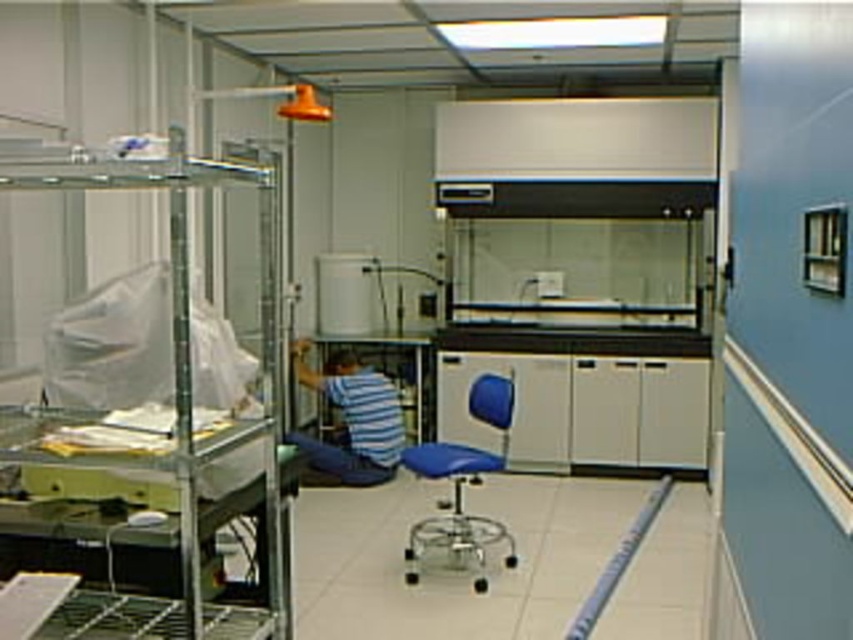
Between blue striped shirt at center and blue fabric chair at center, which one appears on the right side from the viewer's perspective?

Positioned to the right is blue fabric chair at center.

Is blue striped shirt at center thinner than blue fabric chair at center?

Incorrect, blue striped shirt at center's width is not less than blue fabric chair at center's.

Describe the element at coordinates (351, 420) in the screenshot. I see `blue striped shirt at center` at that location.

The image size is (853, 640). I want to click on blue striped shirt at center, so click(351, 420).